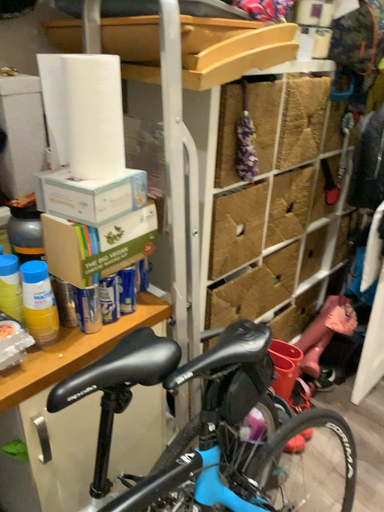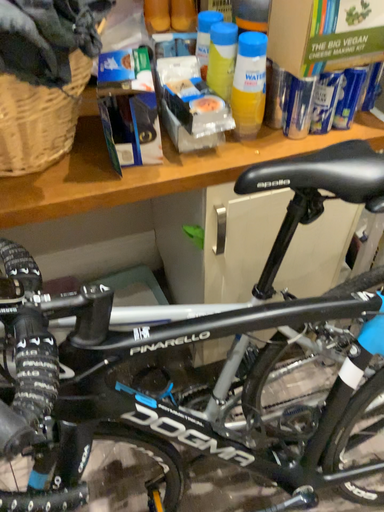
Question: How did the camera likely rotate when shooting the video?

Choices:
 (A) rotated upward
 (B) rotated downward

Answer: (B)